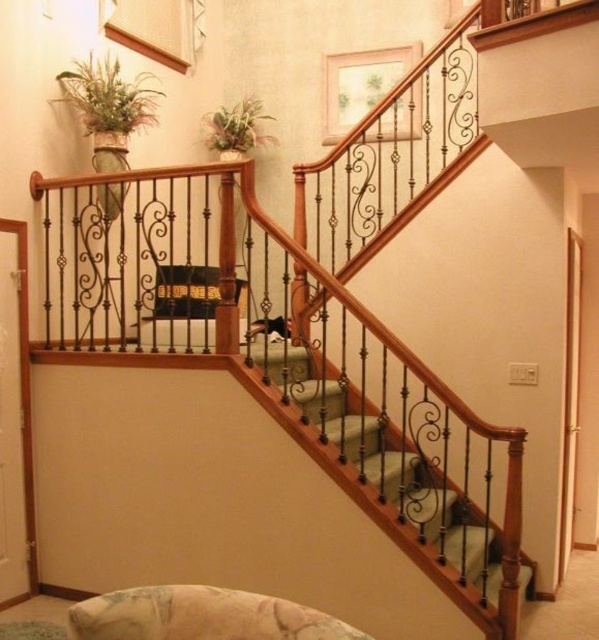
Question: Is green carpeted stairs at center smaller than green leafy plant at upper center?

Choices:
 (A) no
 (B) yes

Answer: (A)

Question: Which of these objects is positioned closest to the green matte plant at upper left?

Choices:
 (A) wrought iron railing at center
 (B) green carpeted stairs at center
 (C) velvet green couch at center

Answer: (C)

Question: Which point is farther to the camera?

Choices:
 (A) (403, 538)
 (B) (326, 392)
 (C) (95, 109)

Answer: (B)

Question: Is wrought iron railing at center bigger than green matte plant at upper left?

Choices:
 (A) no
 (B) yes

Answer: (B)

Question: Estimate the real-world distances between objects in this image. Which object is closer to the velvet green couch at center?

Choices:
 (A) green matte plant at upper left
 (B) wrought iron railing at center

Answer: (B)

Question: Does green carpeted stairs at center appear under green leafy plant at upper center?

Choices:
 (A) no
 (B) yes

Answer: (B)